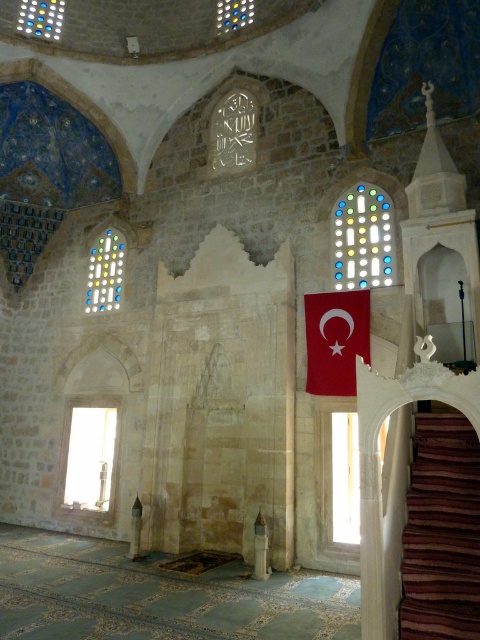
You are standing inside the mosque and want to take a photo of the multicolored stained glass at upper center without including the brown wooden stairs at lower right in the frame. Is this possible given their positions?

The brown wooden stairs at lower right are closer to the viewer than the multicolored stained glass at upper center. Therefore, it is possible to adjust the camera angle or position to exclude the stairs while focusing on the stained glass.